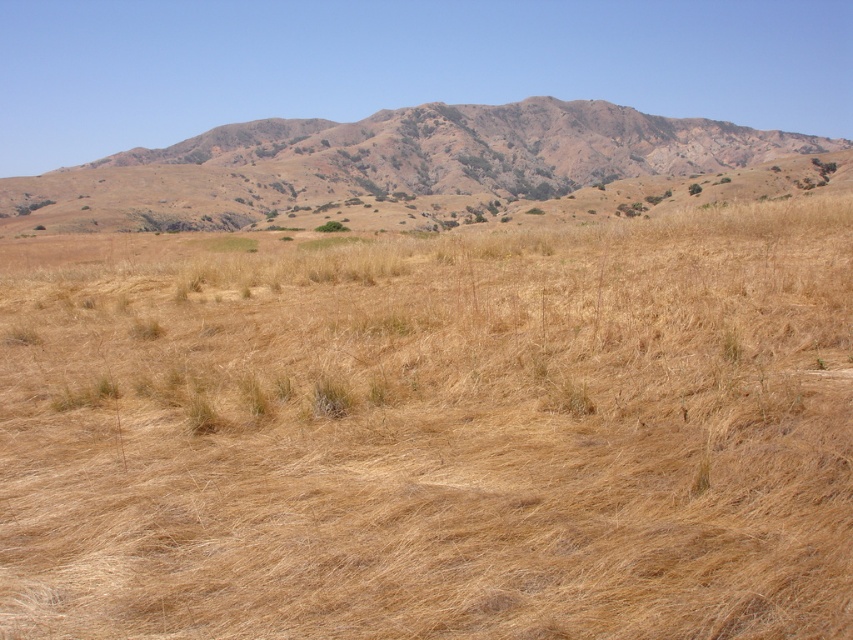
Question: Can you confirm if dry grass at center is positioned below brown/dry grassy at upper center?

Choices:
 (A) yes
 (B) no

Answer: (A)

Question: Can you confirm if dry grass at center is smaller than brown/dry grassy at upper center?

Choices:
 (A) yes
 (B) no

Answer: (A)

Question: Which of the following is the closest to the observer?

Choices:
 (A) dry grass at center
 (B) brown/dry grassy at upper center

Answer: (A)

Question: From the image, what is the correct spatial relationship of dry grass at center in relation to brown/dry grassy at upper center?

Choices:
 (A) left
 (B) right

Answer: (B)